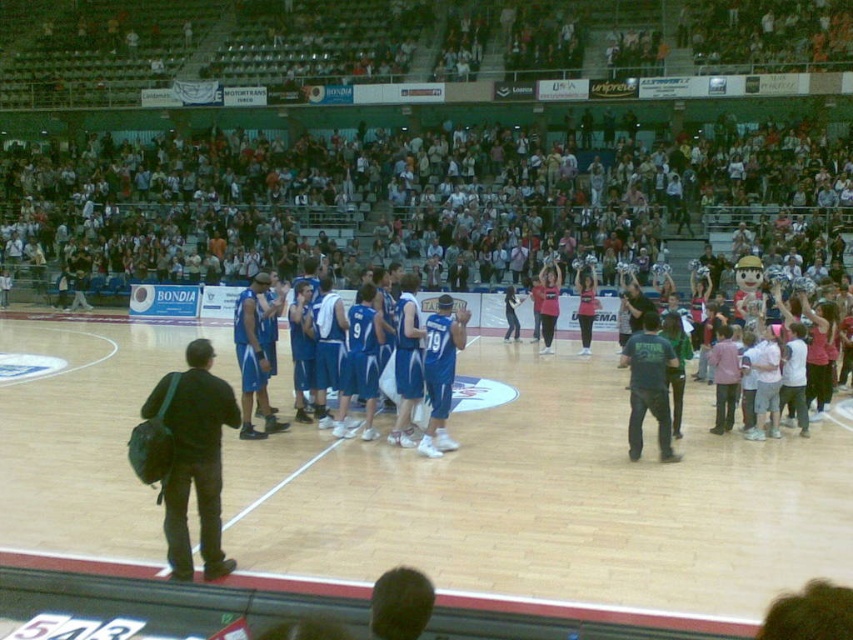
Is point (585, 419) farther from camera compared to point (585, 316)?

No.

Does wooden floor at center have a lesser height compared to pink jersey at center?

Incorrect, wooden floor at center's height does not fall short of pink jersey at center's.

Measure the distance between point (759, 596) and camera.

Point (759, 596) is 5.89 meters from camera.

Locate an element on the screen. This screenshot has height=640, width=853. wooden floor at center is located at coordinates (552, 499).

Describe the element at coordinates (201, 493) in the screenshot. I see `black fabric bag at left` at that location.

Based on the photo, can you confirm if black fabric bag at left is positioned to the left of pink jersey at center?

Indeed, black fabric bag at left is positioned on the left side of pink jersey at center.

At what (x,y) coordinates should I click in order to perform the action: click on black fabric bag at left. Please return your answer as a coordinate pair (x, y). Looking at the image, I should click on (201, 493).

The width and height of the screenshot is (853, 640). I want to click on black fabric bag at left, so point(201,493).

Is point (297, 524) positioned in front of point (547, 275)?

That is True.

Is the position of wooden floor at center less distant than that of pink fabric cheerleader at center?

Yes, it is in front of pink fabric cheerleader at center.

Who is more forward, (91, 400) or (550, 323)?

Positioned in front is point (91, 400).

I want to click on wooden floor at center, so click(x=552, y=499).